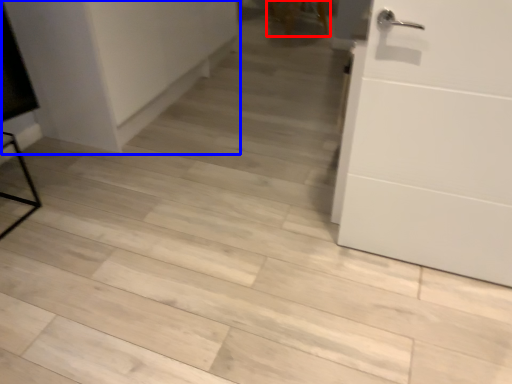
Question: Among these objects, which one is nearest to the camera, chair (highlighted by a red box) or cabinetry (highlighted by a blue box)?

Choices:
 (A) chair
 (B) cabinetry

Answer: (B)